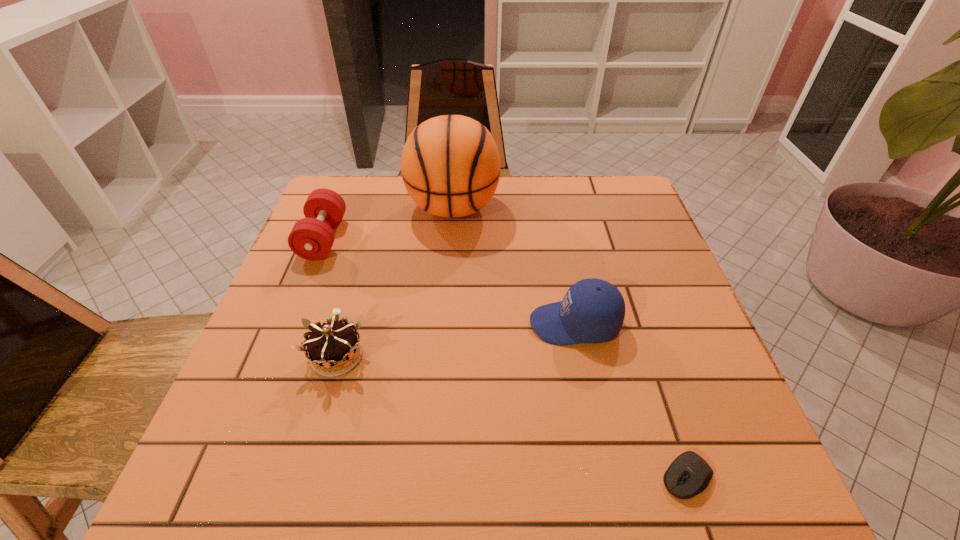
Image resolution: width=960 pixels, height=540 pixels. What are the coordinates of `free spot located 0.060m on the front-facing side of the cap` in the screenshot? It's located at (501, 324).

Image resolution: width=960 pixels, height=540 pixels. I want to click on vacant space positioned 0.050m on the right of the dumbbell, so click(x=362, y=239).

At what (x,y) coordinates should I click in order to perform the action: click on vacant area situated 0.050m on the right of the crown. Please return your answer as a coordinate pair (x, y). Looking at the image, I should click on (393, 356).

Where is `free location located 0.300m on the back of the nearest object`? free location located 0.300m on the back of the nearest object is located at coordinates (635, 318).

You are a GUI agent. You are given a task and a screenshot of the screen. Output one action in this format:
    pyautogui.click(x=<x>, y=<y>)
    Task: Click on the basketball that is positioned at the far edge
    
    Given the screenshot: What is the action you would take?
    pyautogui.click(x=450, y=165)

Find the location of a particular element. The width and height of the screenshot is (960, 540). dumbbell that is at the far edge is located at coordinates (311, 238).

At what (x,y) coordinates should I click in order to perform the action: click on object at the near edge. Please return your answer as a coordinate pair (x, y). The height and width of the screenshot is (540, 960). Looking at the image, I should click on (689, 474).

The height and width of the screenshot is (540, 960). In order to click on dumbbell located in the left edge section of the desktop in this screenshot , I will do `click(311, 238)`.

This screenshot has width=960, height=540. I want to click on crown that is at the left edge, so click(x=330, y=345).

At what (x,y) coordinates should I click in order to perform the action: click on cap that is at the right edge. Please return your answer as a coordinate pair (x, y). Looking at the image, I should click on (592, 311).